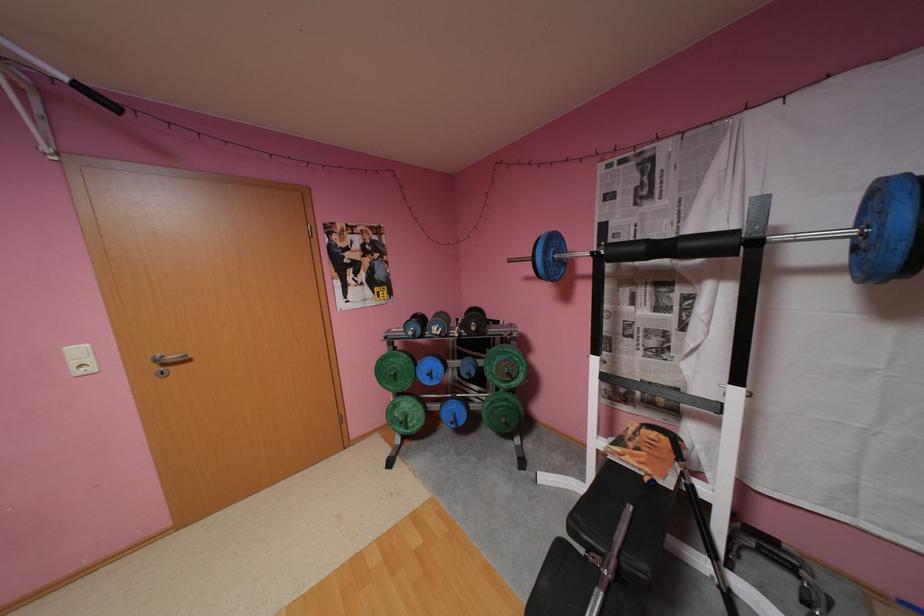
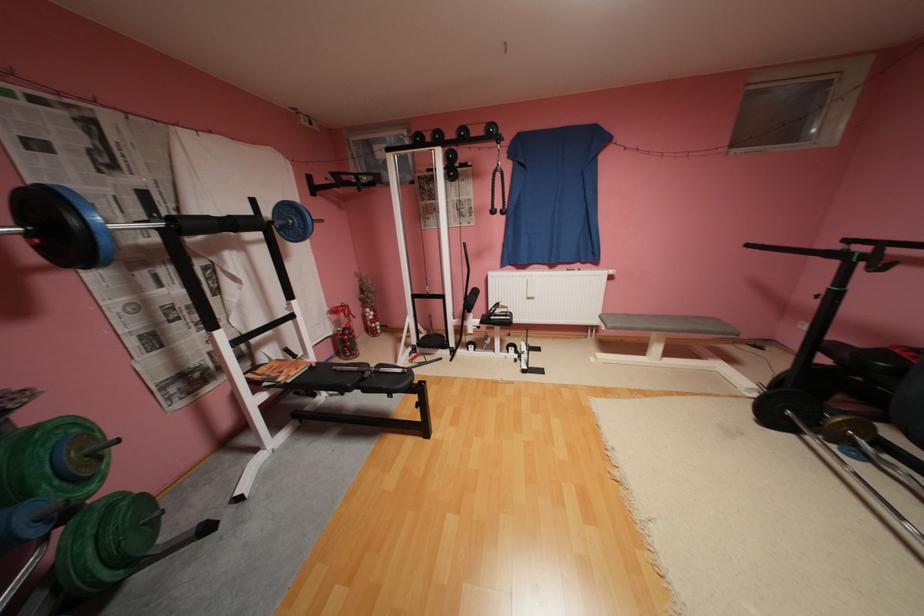
The point at (521, 378) is marked in the first image. Where is the corresponding point in the second image?

(111, 459)